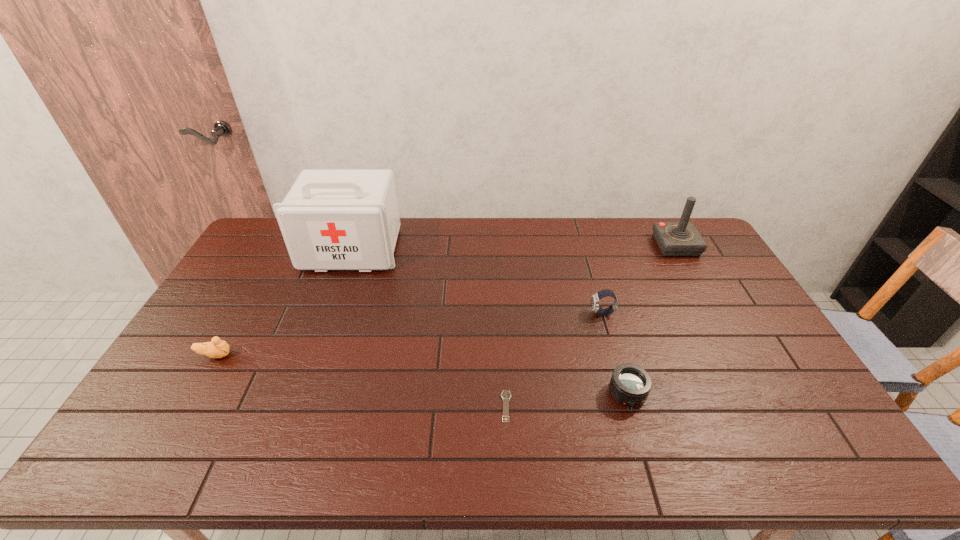
Locate which object is the closest to the fourth farthest object. Please provide its 2D coordinates. Your answer should be formatted as a tuple, i.e. [(x, y)], where the tuple contains the x and y coordinates of a point satisfying the conditions above.

[(330, 219)]

Locate an element on the screen. The image size is (960, 540). vacant space that satisfies the following two spatial constraints: 1. on the face of the third nearest object; 2. on the back side of the nearer watch is located at coordinates (186, 406).

Where is `vacant region that satisfies the following two spatial constraints: 1. on the front-facing side of the fifth object from right to left; 2. on the right side of the shortest object`? The image size is (960, 540). vacant region that satisfies the following two spatial constraints: 1. on the front-facing side of the fifth object from right to left; 2. on the right side of the shortest object is located at coordinates (296, 406).

This screenshot has height=540, width=960. I want to click on free space that satisfies the following two spatial constraints: 1. on the front-facing side of the second object from left to right; 2. on the face of the third nearest object, so click(314, 355).

Identify the location of free point that satisfies the following two spatial constraints: 1. on the face of the leftmost object; 2. on the right side of the shortest object. The image size is (960, 540). (186, 406).